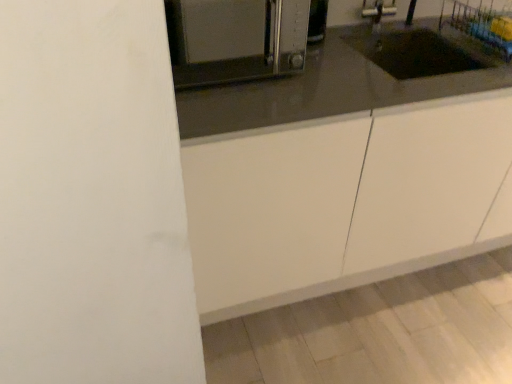
Question: Is white matte cabinet at center at the back of satin silver toaster at upper center?

Choices:
 (A) no
 (B) yes

Answer: (A)

Question: Does satin silver toaster at upper center have a larger size compared to white matte cabinet at center?

Choices:
 (A) yes
 (B) no

Answer: (B)

Question: Does satin silver toaster at upper center come behind white matte cabinet at center?

Choices:
 (A) no
 (B) yes

Answer: (A)

Question: Is satin silver toaster at upper center in front of white matte cabinet at center?

Choices:
 (A) no
 (B) yes

Answer: (B)

Question: Can you confirm if satin silver toaster at upper center is shorter than white matte cabinet at center?

Choices:
 (A) no
 (B) yes

Answer: (B)

Question: From the image's perspective, would you say satin silver toaster at upper center is positioned over white matte cabinet at center?

Choices:
 (A) no
 (B) yes

Answer: (B)

Question: Is white matte cabinet at center shorter than satin silver toaster at upper center?

Choices:
 (A) yes
 (B) no

Answer: (B)

Question: Can you confirm if white matte cabinet at center is positioned to the left of satin silver toaster at upper center?

Choices:
 (A) no
 (B) yes

Answer: (A)

Question: Is white matte cabinet at center outside satin silver toaster at upper center?

Choices:
 (A) yes
 (B) no

Answer: (A)

Question: Is white matte cabinet at center not close to satin silver toaster at upper center?

Choices:
 (A) yes
 (B) no

Answer: (A)

Question: From a real-world perspective, is white matte cabinet at center on top of satin silver toaster at upper center?

Choices:
 (A) no
 (B) yes

Answer: (A)

Question: Is white matte cabinet at center surrounding satin silver toaster at upper center?

Choices:
 (A) no
 (B) yes

Answer: (A)

Question: Is point (285, 236) closer or farther from the camera than point (187, 71)?

Choices:
 (A) closer
 (B) farther

Answer: (A)